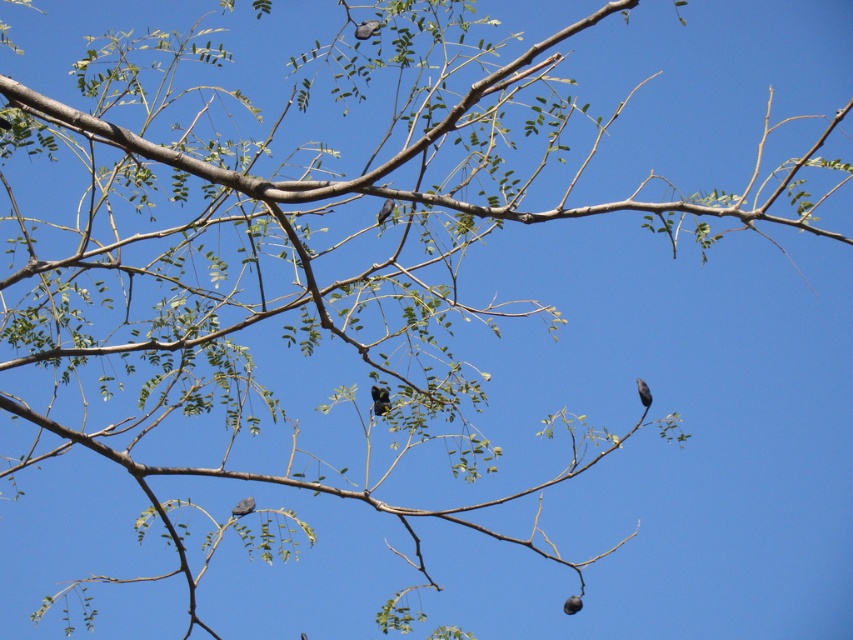
Question: Based on their relative distances, which object is nearer to the gray matte bird at center?

Choices:
 (A) gray matte bird at right
 (B) brown matte bird at center
 (C) silvery metallic bird at upper center
 (D) silvery metallic bird at center

Answer: (D)

Question: Does silvery metallic bird at upper center appear under gray matte bird at right?

Choices:
 (A) yes
 (B) no

Answer: (B)

Question: Which object appears farthest from the camera in this image?

Choices:
 (A) gray matte bird at center
 (B) brown matte bird at center
 (C) silvery metallic bird at upper center
 (D) silvery metallic bird at center

Answer: (D)

Question: Is gray matte bird at right to the right of brown matte bird at center from the viewer's perspective?

Choices:
 (A) no
 (B) yes

Answer: (B)

Question: Is gray matte bird at center wider than brown matte bird at center?

Choices:
 (A) no
 (B) yes

Answer: (B)

Question: Based on their relative distances, which object is farther from the gray matte bird at right?

Choices:
 (A) gray matte bird at center
 (B) brown matte bird at center
 (C) silvery metallic bird at upper center
 (D) silvery metallic bird at center

Answer: (C)